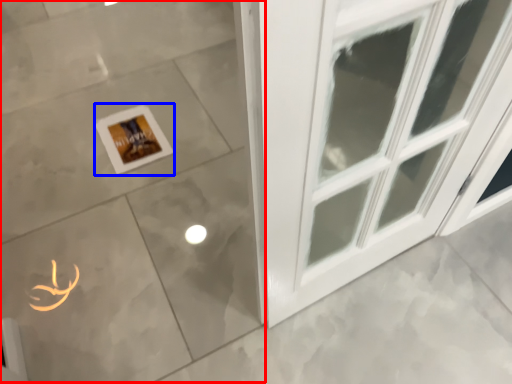
Question: Which object is further to the camera taking this photo, ceramic tile (highlighted by a red box) or picture frame (highlighted by a blue box)?

Choices:
 (A) ceramic tile
 (B) picture frame

Answer: (B)